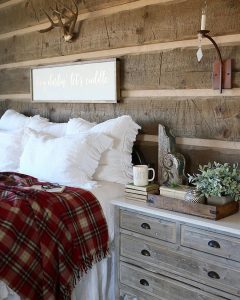
The width and height of the screenshot is (240, 300). I want to click on nightstand wooden, so click(168, 239).